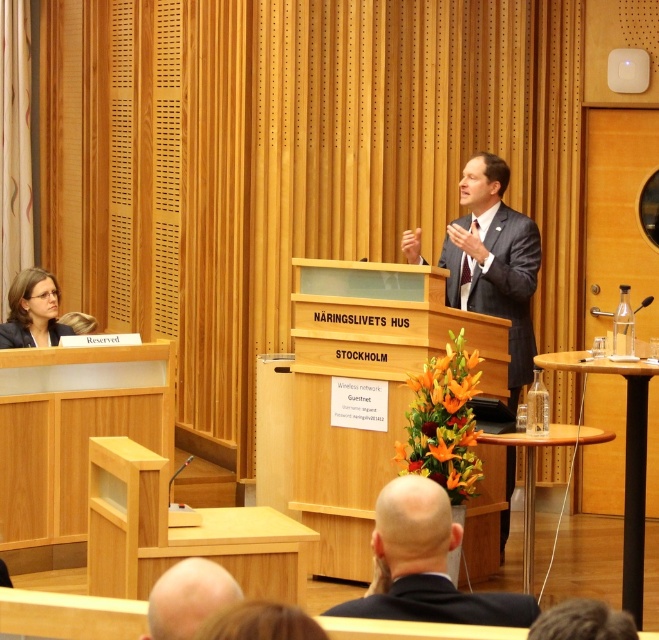
You are attending a formal event and notice two attendees wearing black matte clothing. The first is wearing a black matte suit at lower center, and the second is wearing a matte black blazer at left. Which attendee is wearing a larger garment?

The black matte suit at lower center has a larger size compared to the matte black blazer at left, so the attendee wearing the black matte suit at lower center is wearing a larger garment.

You are attending a formal event in a conference room and notice a black suit at center. Where exactly is the black suit positioned in the room?

The black suit at center is located at point coordinates of 0.883 along the horizontal axis and 0.645 along the vertical axis.

In the scene shown: You are attending a conference and see the dark gray suit at center and the bald head at lower center. Which one is taller?

The dark gray suit at center is much taller than the bald head at lower center.